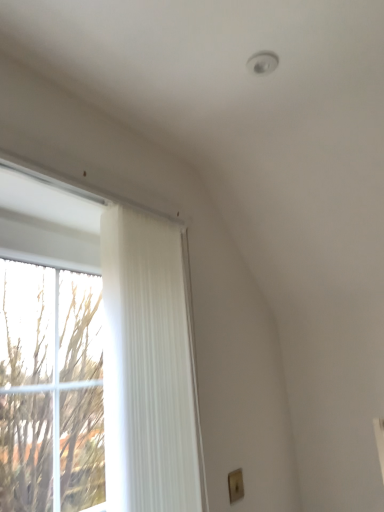
The image size is (384, 512). What do you see at coordinates (147, 368) in the screenshot? I see `white pleated curtain at left` at bounding box center [147, 368].

At what (x,y) coordinates should I click in order to perform the action: click on white pleated curtain at left. Please return your answer as a coordinate pair (x, y). The width and height of the screenshot is (384, 512). Looking at the image, I should click on (147, 368).

Where is `white pleated curtain at left`? white pleated curtain at left is located at coordinates (147, 368).